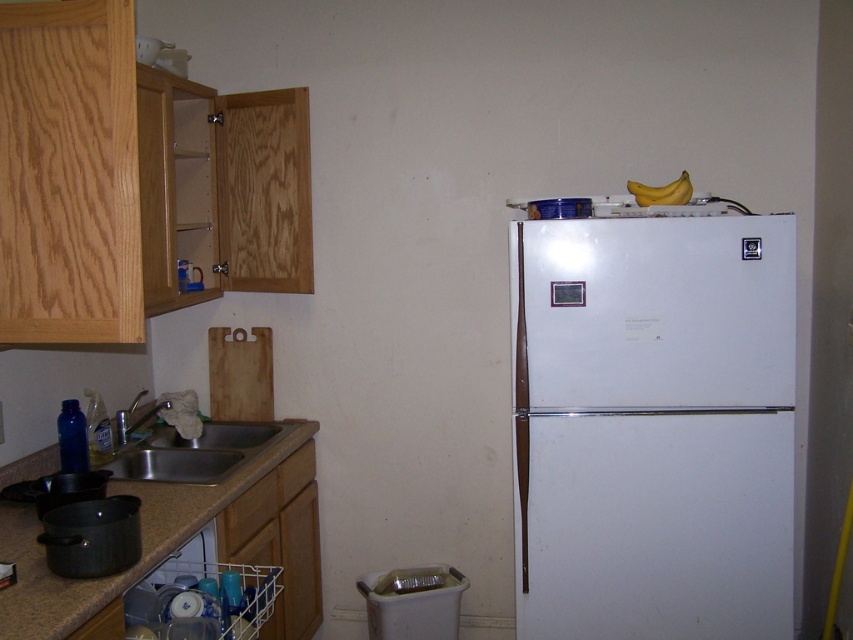
Question: Can you confirm if brown granite countertop at lower left is positioned to the left of stainless steel sink at lower left?

Choices:
 (A) yes
 (B) no

Answer: (A)

Question: Is brown granite countertop at lower left above stainless steel sink at lower left?

Choices:
 (A) no
 (B) yes

Answer: (A)

Question: Is brown granite countertop at lower left in front of yellow matte bananas at upper right?

Choices:
 (A) yes
 (B) no

Answer: (A)

Question: Which of these objects is positioned farthest from the white matte refrigerator at right?

Choices:
 (A) brown granite countertop at lower left
 (B) white plastic dish washer at lower left

Answer: (A)

Question: Which point appears closest to the camera in this image?

Choices:
 (A) (558, 369)
 (B) (251, 612)

Answer: (B)

Question: Estimate the real-world distances between objects in this image. Which object is closer to the brown granite countertop at lower left?

Choices:
 (A) stainless steel sink at lower left
 (B) white plastic dish washer at lower left
 (C) yellow matte bananas at upper right

Answer: (B)